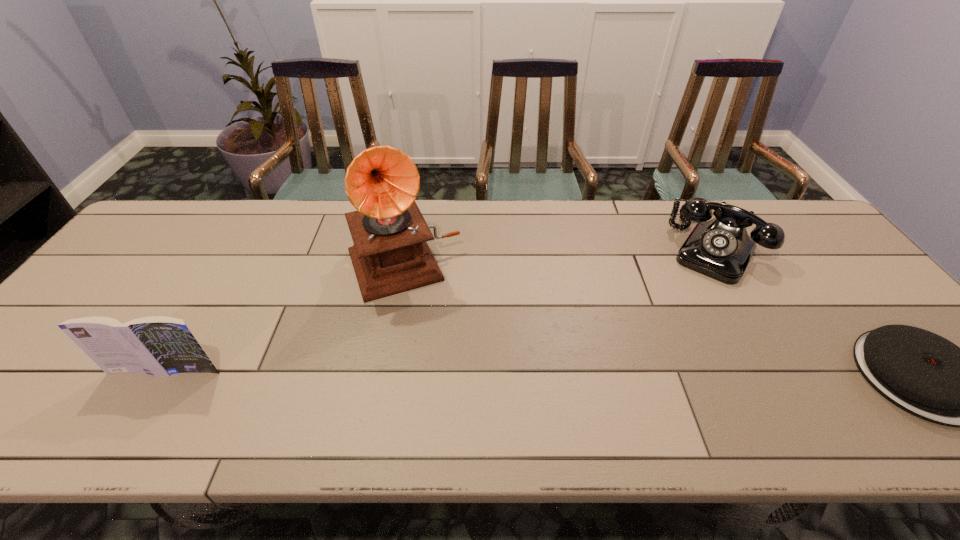
I want to click on the leftmost object, so click(157, 345).

At what (x,y) coordinates should I click in order to perform the action: click on book. Please return your answer as a coordinate pair (x, y). Looking at the image, I should click on (157, 345).

Where is `telephone`? The image size is (960, 540). telephone is located at coordinates (720, 248).

I want to click on the second shortest object, so click(x=720, y=248).

Where is `the second object from left to right`? The image size is (960, 540). the second object from left to right is located at coordinates (390, 255).

Find the location of `the tallest object`. the tallest object is located at coordinates (390, 255).

This screenshot has width=960, height=540. In order to click on blank area located on the dial of the telephone in this screenshot , I will do `click(684, 311)`.

This screenshot has width=960, height=540. In order to click on vacant space positioned on the dial of the telephone in this screenshot , I will do `click(685, 307)`.

This screenshot has height=540, width=960. Identify the location of vacant space positioned on the dial of the telephone. (652, 366).

Image resolution: width=960 pixels, height=540 pixels. What are the coordinates of `free space located 0.220m on the horn of the tallest object` in the screenshot? It's located at (446, 366).